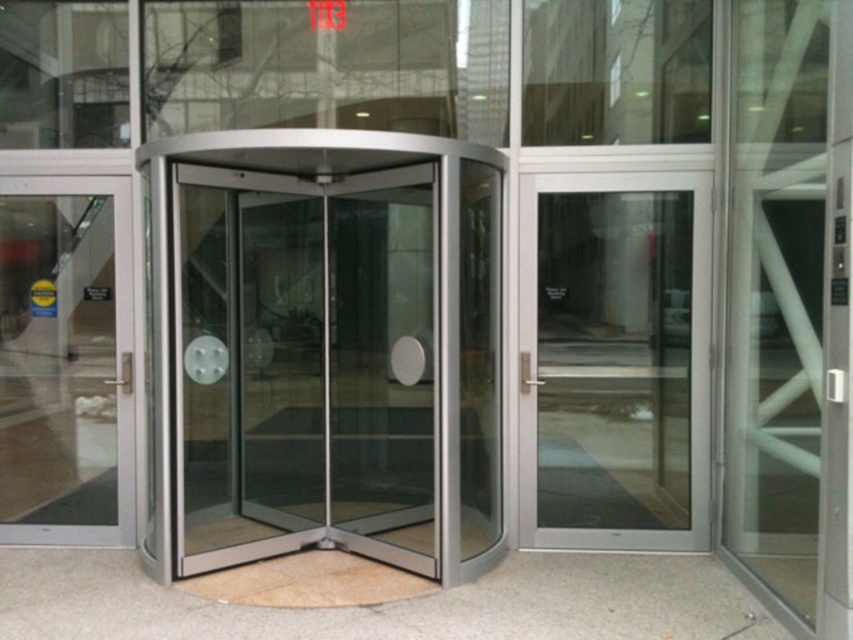
Based on the photo, which is above, clear glass door at right or transparent glass door at left?

clear glass door at right is higher up.

Locate an element on the screen. The image size is (853, 640). clear glass door at right is located at coordinates (614, 358).

This screenshot has height=640, width=853. Find the location of `clear glass door at right`. clear glass door at right is located at coordinates (614, 358).